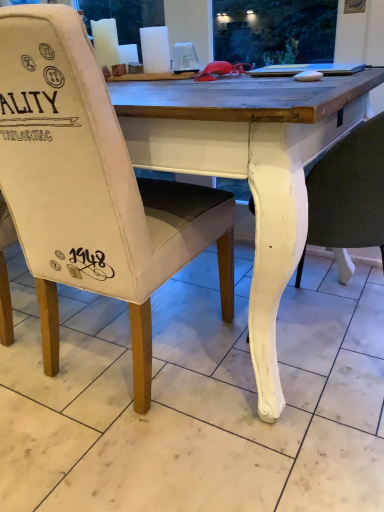
The height and width of the screenshot is (512, 384). Find the location of `blank area beneath white painted wood chair at lower right, placed as the second chair when sorted from left to right (from a real-world perspective)`. blank area beneath white painted wood chair at lower right, placed as the second chair when sorted from left to right (from a real-world perspective) is located at coordinates (326, 329).